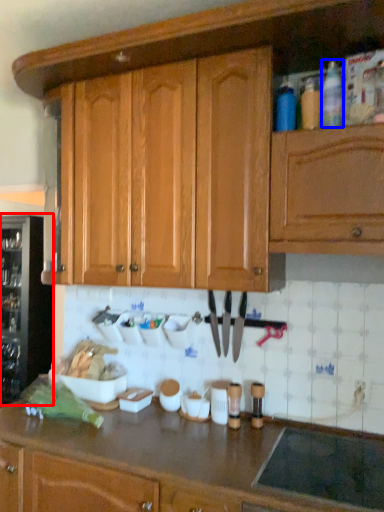
Question: Which object appears farthest to the camera in this image, wine cooler (highlighted by a red box) or bottle (highlighted by a blue box)?

Choices:
 (A) wine cooler
 (B) bottle

Answer: (A)